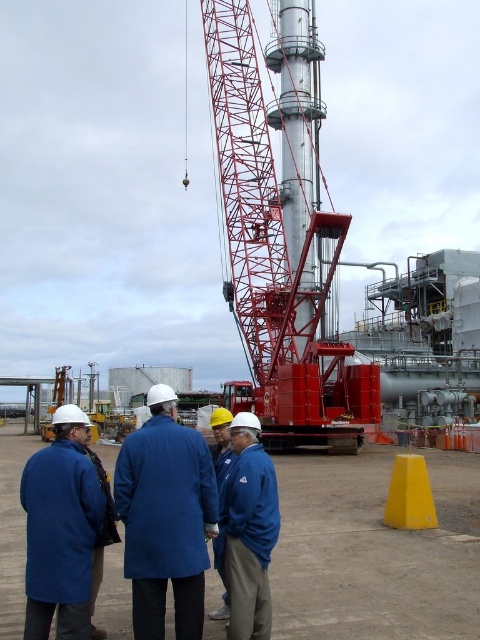
Does red metallic crane at center have a greater height compared to blue matte jacket at lower left?

Yes, red metallic crane at center is taller than blue matte jacket at lower left.

Can you confirm if red metallic crane at center is positioned above blue matte jacket at lower left?

Correct, red metallic crane at center is located above blue matte jacket at lower left.

Which is behind, point (313, 336) or point (68, 436)?

Positioned behind is point (313, 336).

This screenshot has width=480, height=640. What are the coordinates of `red metallic crane at center` in the screenshot? It's located at (278, 252).

Who is shorter, blue fabric coat at center or yellow matte cone at lower right?

yellow matte cone at lower right is shorter.

What do you see at coordinates (166, 516) in the screenshot? I see `blue fabric coat at center` at bounding box center [166, 516].

Does point (180, 486) come closer to viewer compared to point (406, 467)?

Yes.

This screenshot has height=640, width=480. Identify the location of blue fabric coat at center. (166, 516).

Does red metallic crane at center have a greater width compared to blue fabric coat at center?

Indeed, red metallic crane at center has a greater width compared to blue fabric coat at center.

Based on the photo, is red metallic crane at center to the right of blue fabric coat at center from the viewer's perspective?

Yes, red metallic crane at center is to the right of blue fabric coat at center.

Looking at this image, measure the distance between point (308, 172) and camera.

A distance of 411.69 feet exists between point (308, 172) and camera.

The width and height of the screenshot is (480, 640). I want to click on red metallic crane at center, so click(278, 252).